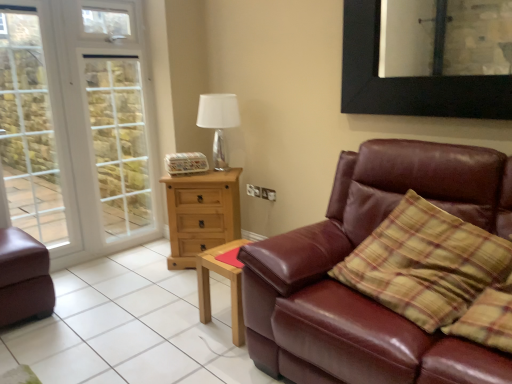
At what (x,y) coordinates should I click in order to perform the action: click on free location in front of light brown wooden chest of drawers at center. Please return your answer as a coordinate pair (x, y). The width and height of the screenshot is (512, 384). Looking at the image, I should click on coord(178,284).